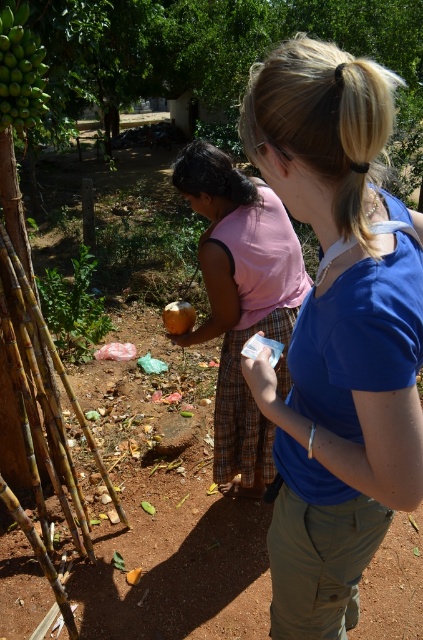
Question: From the image, what is the correct spatial relationship of pink fabric dress at center in relation to green matte bananas at upper left?

Choices:
 (A) below
 (B) above

Answer: (A)

Question: Which of these objects is positioned farthest from the pink fabric dress at center?

Choices:
 (A) smooth brown coconut at center
 (B) green matte bananas at upper left

Answer: (B)

Question: Which point is closer to the camera?

Choices:
 (A) pink fabric dress at center
 (B) blue cotton shirt at upper right

Answer: (B)

Question: Can you confirm if blue cotton shirt at upper right is wider than green matte bananas at upper left?

Choices:
 (A) yes
 (B) no

Answer: (A)

Question: Estimate the real-world distances between objects in this image. Which object is farther from the pink fabric dress at center?

Choices:
 (A) blue cotton shirt at upper right
 (B) smooth brown coconut at center
 (C) green matte bananas at upper left

Answer: (A)

Question: Can you confirm if blue cotton shirt at upper right is positioned below green matte bananas at upper left?

Choices:
 (A) no
 (B) yes

Answer: (B)